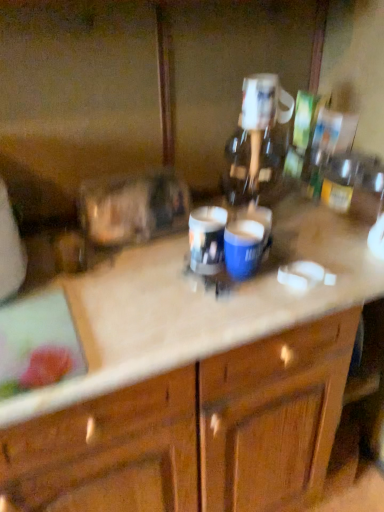
Question: Can you confirm if matte plastic cup at center, which is counted as the 1th beverage, starting from the left, is bigger than blue glossy mug at center, which is the first beverage in right-to-left order?

Choices:
 (A) yes
 (B) no

Answer: (A)

Question: Does matte plastic cup at center, arranged as the second beverage when viewed from the right, have a greater width compared to blue glossy mug at center, the 2th beverage from the left?

Choices:
 (A) no
 (B) yes

Answer: (A)

Question: From the image's perspective, would you say matte plastic cup at center, arranged as the second beverage when viewed from the right, is shown under blue glossy mug at center, the 2th beverage from the left?

Choices:
 (A) yes
 (B) no

Answer: (B)

Question: Is matte plastic cup at center, arranged as the second beverage when viewed from the right, next to blue glossy mug at center, which is the first beverage in right-to-left order, and touching it?

Choices:
 (A) no
 (B) yes

Answer: (B)

Question: From the image's perspective, is matte plastic cup at center, which is counted as the 1th beverage, starting from the left, on blue glossy mug at center, the 2th beverage from the left?

Choices:
 (A) no
 (B) yes

Answer: (B)

Question: Can you confirm if matte plastic cup at center, arranged as the second beverage when viewed from the right, is shorter than blue glossy mug at center, which is the first beverage in right-to-left order?

Choices:
 (A) no
 (B) yes

Answer: (A)

Question: Is beige marble countertop at center to the left of matte plastic cup at center, arranged as the second beverage when viewed from the right, from the viewer's perspective?

Choices:
 (A) yes
 (B) no

Answer: (A)

Question: Can you confirm if beige marble countertop at center is thinner than matte plastic cup at center, arranged as the second beverage when viewed from the right?

Choices:
 (A) no
 (B) yes

Answer: (A)

Question: Is beige marble countertop at center completely or partially outside of matte plastic cup at center, which is counted as the 1th beverage, starting from the left?

Choices:
 (A) no
 (B) yes

Answer: (B)

Question: Can you confirm if beige marble countertop at center is positioned to the right of matte plastic cup at center, which is counted as the 1th beverage, starting from the left?

Choices:
 (A) yes
 (B) no

Answer: (B)

Question: From a real-world perspective, is beige marble countertop at center on matte plastic cup at center, which is counted as the 1th beverage, starting from the left?

Choices:
 (A) yes
 (B) no

Answer: (B)

Question: Is beige marble countertop at center taller than matte plastic cup at center, which is counted as the 1th beverage, starting from the left?

Choices:
 (A) yes
 (B) no

Answer: (A)

Question: Is beige marble countertop at center to the left of blue glossy mug at center, the 2th beverage from the left, from the viewer's perspective?

Choices:
 (A) yes
 (B) no

Answer: (A)